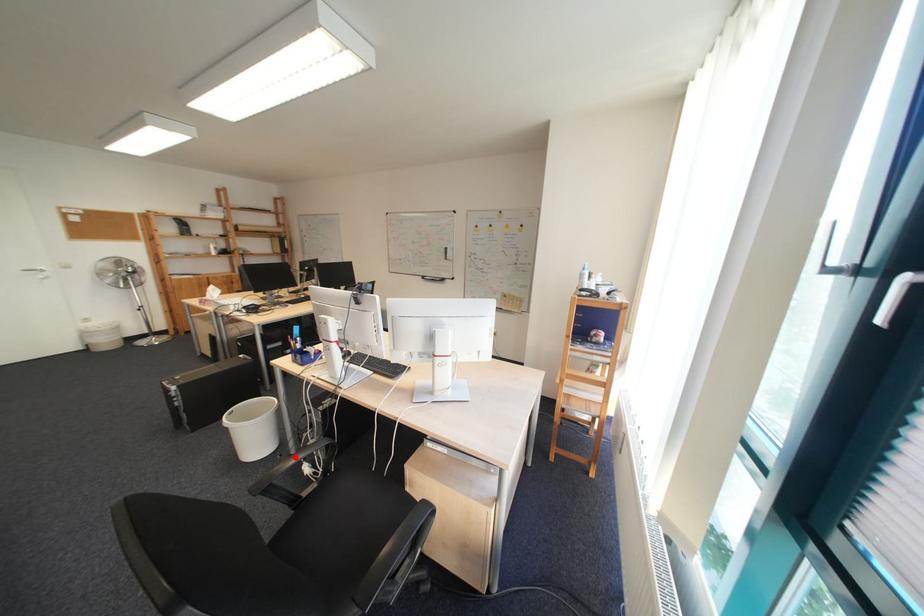
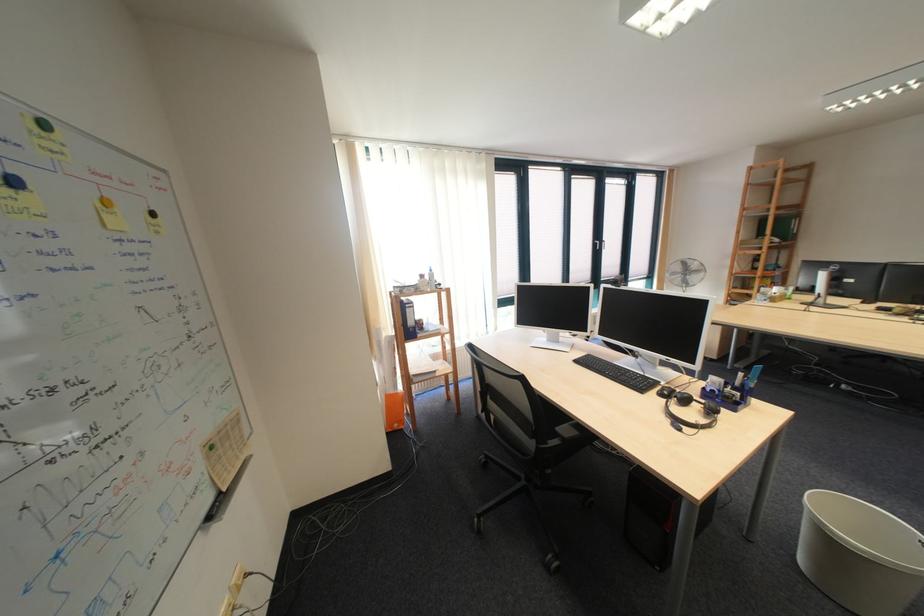
Question: I am providing you with two images of the same scene from different viewpoints. A red point is marked on the first image. Is the red point's position out of view in image 2?

Choices:
 (A) Yes
 (B) No

Answer: (A)